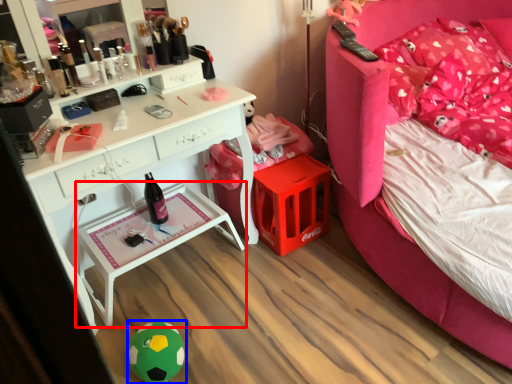
Question: Which object appears closest to the camera in this image, nightstand (highlighted by a red box) or toy (highlighted by a blue box)?

Choices:
 (A) nightstand
 (B) toy

Answer: (B)